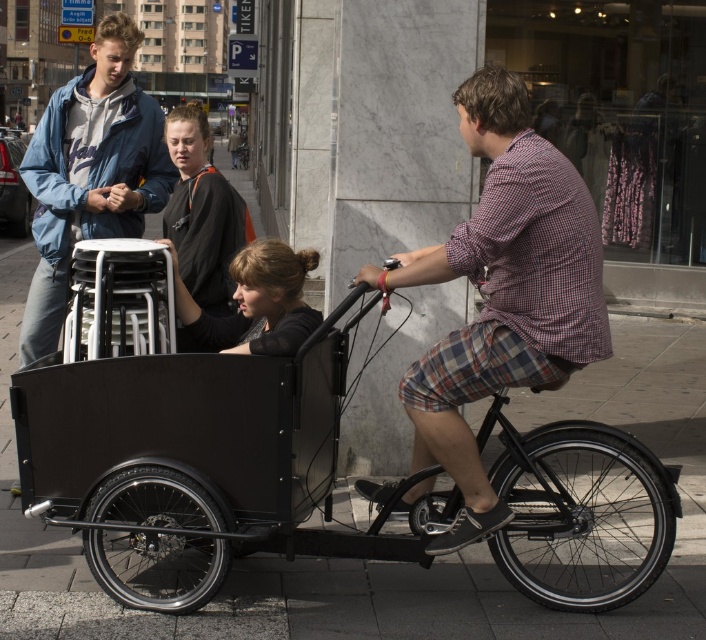
Question: Which of the following is the closest to the observer?

Choices:
 (A) (429, 381)
 (B) (239, 200)

Answer: (A)

Question: Does black fabric jacket at center have a larger size compared to matte black jacket at center?

Choices:
 (A) no
 (B) yes

Answer: (A)

Question: Does matte blue jacket at upper left have a lesser width compared to matte black jacket at center?

Choices:
 (A) no
 (B) yes

Answer: (A)

Question: Among these objects, which one is farthest from the camera?

Choices:
 (A) black matte cargo bike at center
 (B) matte black jacket at center

Answer: (B)

Question: Does plaid cotton shorts at center have a lesser width compared to black fabric jacket at center?

Choices:
 (A) no
 (B) yes

Answer: (A)

Question: Which point appears closest to the camera in this image?

Choices:
 (A) (268, 387)
 (B) (126, 35)
 (C) (520, 252)

Answer: (C)